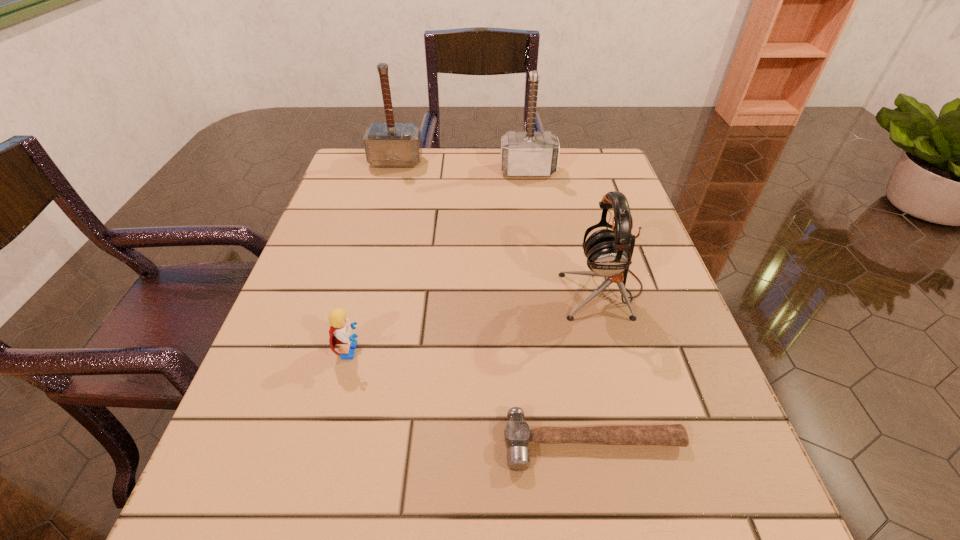
Where is `the leftmost hammer`? This screenshot has height=540, width=960. the leftmost hammer is located at coordinates (391, 144).

I want to click on earphone, so click(x=609, y=252).

Where is `Lego`? Lego is located at coordinates (340, 332).

You are a GUI agent. You are given a task and a screenshot of the screen. Output one action in this format:
    pyautogui.click(x=<x>, y=<y>)
    Task: Click on the second nearest object
    The height and width of the screenshot is (540, 960).
    Given the screenshot: What is the action you would take?
    pyautogui.click(x=340, y=332)

Identify the location of the shortest hammer. (517, 433).

Find the location of a particular element. This screenshot has height=540, width=960. the nearest hammer is located at coordinates (517, 433).

What are the coordinates of `free space located on the front of the leftmost hammer` in the screenshot? It's located at (374, 241).

At what (x,y) coordinates should I click in order to perform the action: click on vacant space positioned on the left of the third farthest object. Please return your answer as a coordinate pair (x, y). The image size is (960, 540). Looking at the image, I should click on (531, 289).

Where is `free space located on the front-facing side of the Lego`? The image size is (960, 540). free space located on the front-facing side of the Lego is located at coordinates (508, 350).

Find the location of `vacant space situated on the striking face of the shortest hammer`. vacant space situated on the striking face of the shortest hammer is located at coordinates (608, 520).